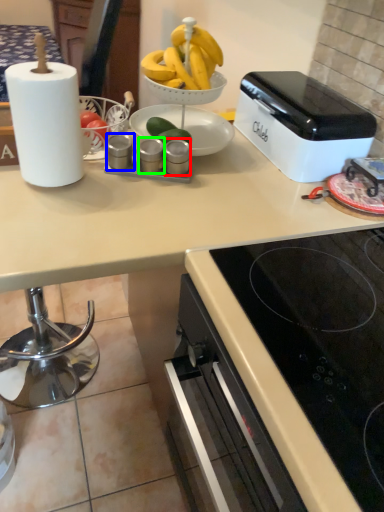
Question: Which object is the farthest from appliance (highlighted by a red box)? Choose among these: appliance (highlighted by a blue box) or appliance (highlighted by a green box).

Choices:
 (A) appliance
 (B) appliance

Answer: (A)